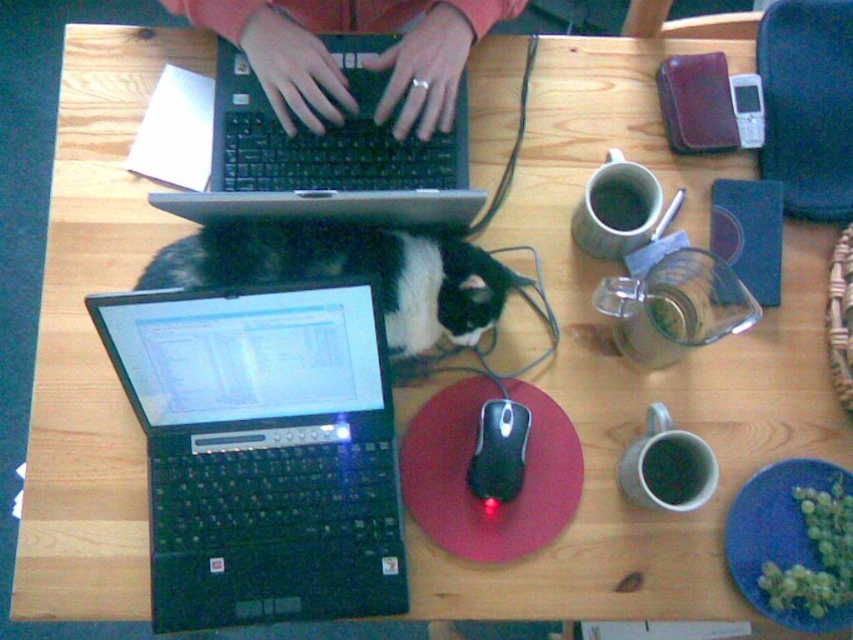
From the picture: You are organizing a workspace and need to ensure there is enough space between the black plastic laptop at center and the black fur cat at center. Given that the cat requires a minimum of 30 cm of space to move comfortably, can you determine if the current setup allows this?

The black plastic laptop at center has a larger size compared to the black fur cat at center, but the description does not provide specific measurements between them. Therefore, it is unclear if the current setup provides the required 30 cm of space for the cat to move comfortably.

You are organizing cables on a desk and need to connect a black plastic mouse at center to a black matte laptop at upper left. Given that the cable you have is 30 centimeters long, will it be sufficient to reach between the two devices?

The distance between the black matte laptop at upper left and the black plastic mouse at center is 31.34 centimeters. Since the cable is only 30 centimeters long, it will not be long enough to connect them.

You are organizing your desk and want to place the black plastic mouse at center closer to the edge of the table. The black matte laptop at upper left is currently in the way. Can you slide the mouse to the edge without moving the laptop?

The black matte laptop at upper left is wider than the black plastic mouse at center. Since the laptop is wider, it would block more space, making it difficult to slide the mouse to the edge without moving the laptop.